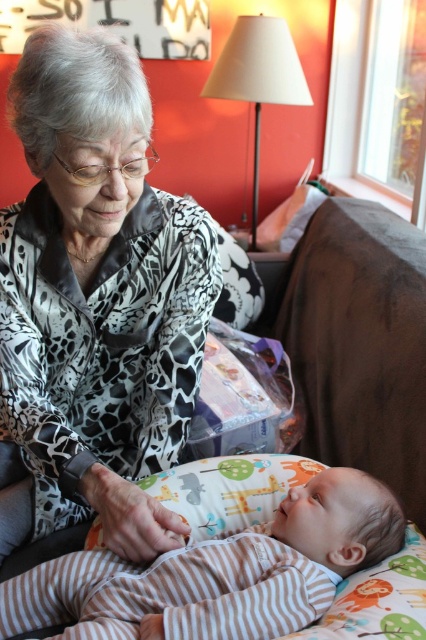
Can you confirm if silky leopard print blouse at center is wider than striped cotton onesie at lower center?

Incorrect, silky leopard print blouse at center's width does not surpass striped cotton onesie at lower center's.

Which is in front, point (155, 544) or point (331, 483)?

Positioned in front is point (155, 544).

Locate an element on the screen. The height and width of the screenshot is (640, 426). silky leopard print blouse at center is located at coordinates (95, 298).

Between silky leopard print blouse at center and white fabric lampshade at upper center, which one has less height?

silky leopard print blouse at center

Between point (14, 376) and point (273, 74), which one is positioned in front?

Point (14, 376) is in front.

Locate an element on the screen. silky leopard print blouse at center is located at coordinates (95, 298).

Can you confirm if striped cotton onesie at lower center is shorter than white fabric lampshade at upper center?

Indeed, striped cotton onesie at lower center has a lesser height compared to white fabric lampshade at upper center.

Between point (241, 636) and point (259, 83), which one is positioned in front?

Point (241, 636) is in front.

Identify the location of striped cotton onesie at lower center. The height and width of the screenshot is (640, 426). (218, 573).